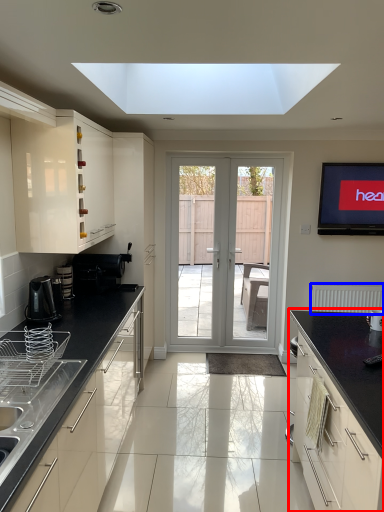
Question: Which object appears farthest to the camera in this image, cabinetry (highlighted by a red box) or radiator (highlighted by a blue box)?

Choices:
 (A) cabinetry
 (B) radiator

Answer: (B)